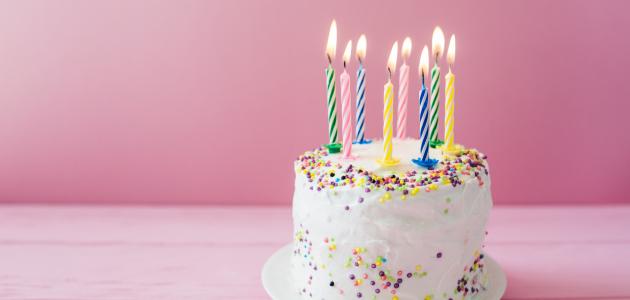
Locate an element on the screen. Image resolution: width=630 pixels, height=300 pixels. birthday candles is located at coordinates (329, 83), (346, 100), (358, 92), (385, 113), (406, 100), (426, 116), (437, 98), (454, 115).